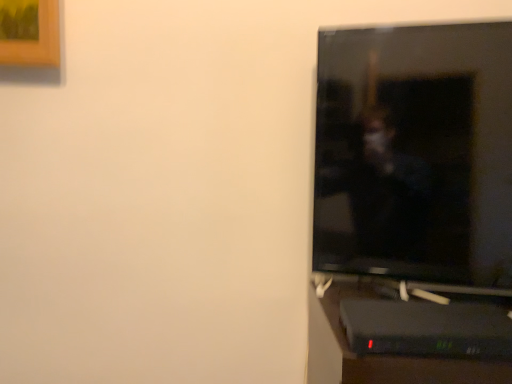
Question: In terms of size, does black glossy tv at right appear bigger or smaller than black plastic computer desk at lower right?

Choices:
 (A) big
 (B) small

Answer: (A)

Question: Relative to black plastic computer desk at lower right, is black glossy tv at right in front or behind?

Choices:
 (A) behind
 (B) front

Answer: (A)

Question: From the image's perspective, relative to black plastic computer desk at lower right, is black glossy tv at right above or below?

Choices:
 (A) above
 (B) below

Answer: (A)

Question: Is black plastic computer desk at lower right in front of or behind black glossy tv at right in the image?

Choices:
 (A) front
 (B) behind

Answer: (A)

Question: Looking at their shapes, would you say black plastic computer desk at lower right is wider or thinner than black glossy tv at right?

Choices:
 (A) thin
 (B) wide

Answer: (B)

Question: Does point (506, 342) appear closer or farther from the camera than point (483, 281)?

Choices:
 (A) farther
 (B) closer

Answer: (B)

Question: Looking at the image, does black plastic computer desk at lower right seem bigger or smaller compared to black glossy tv at right?

Choices:
 (A) small
 (B) big

Answer: (A)